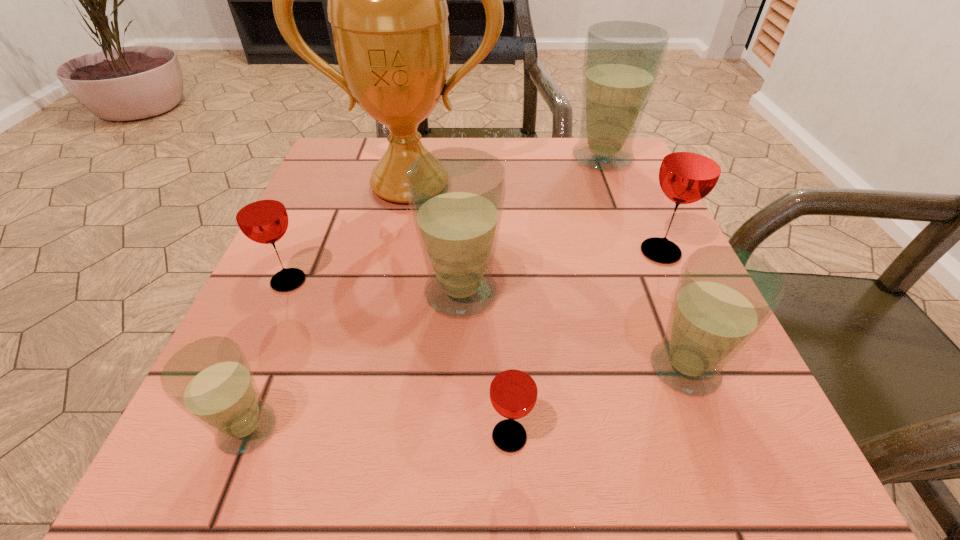
Image resolution: width=960 pixels, height=540 pixels. In the image, there is a desktop. In order to click on vacant space at the near left corner in this screenshot , I will do `click(205, 434)`.

In the image, there is a desktop. Identify the location of blank space at the far right corner. This screenshot has height=540, width=960. (606, 178).

Where is `vacant space at the near right corner`? This screenshot has height=540, width=960. vacant space at the near right corner is located at coordinates (750, 438).

The image size is (960, 540). What are the coordinates of `empty space between the leftmost blue glass and the rightmost red glass` in the screenshot? It's located at (454, 340).

Where is `unoccupied position between the second smallest red glass and the tallest object`? unoccupied position between the second smallest red glass and the tallest object is located at coordinates (349, 233).

Find the location of a particular element. This screenshot has height=540, width=960. free space that is in between the third blue glass from right to left and the third biggest blue glass is located at coordinates (572, 331).

The height and width of the screenshot is (540, 960). What are the coordinates of `vacant area that lies between the biggest red glass and the tallest object` in the screenshot? It's located at (535, 218).

Where is `empty space between the tallest glass and the second smallest blue glass`? The image size is (960, 540). empty space between the tallest glass and the second smallest blue glass is located at coordinates tap(643, 263).

This screenshot has width=960, height=540. I want to click on unoccupied area between the second farthest blue glass and the biggest red glass, so click(x=561, y=273).

Locate an element on the screen. The width and height of the screenshot is (960, 540). free point between the leftmost blue glass and the biggest red glass is located at coordinates (454, 340).